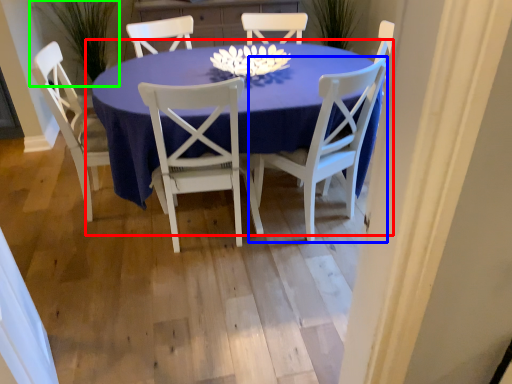
Question: Which is farther away from kitchen & dining room table (highlighted by a red box)? chair (highlighted by a blue box) or plant (highlighted by a green box)?

Choices:
 (A) chair
 (B) plant

Answer: (B)